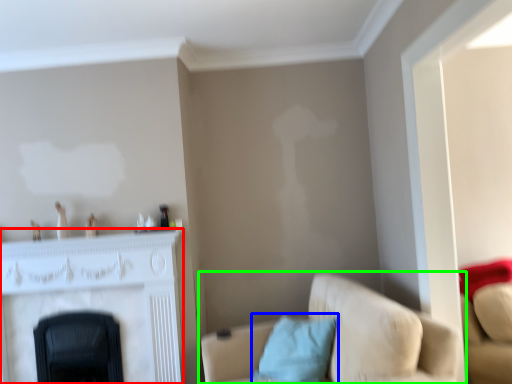
Question: Considering the real-world distances, which object is farthest from fireplace (highlighted by a red box)? pillow (highlighted by a blue box) or studio couch (highlighted by a green box)?

Choices:
 (A) pillow
 (B) studio couch

Answer: (B)